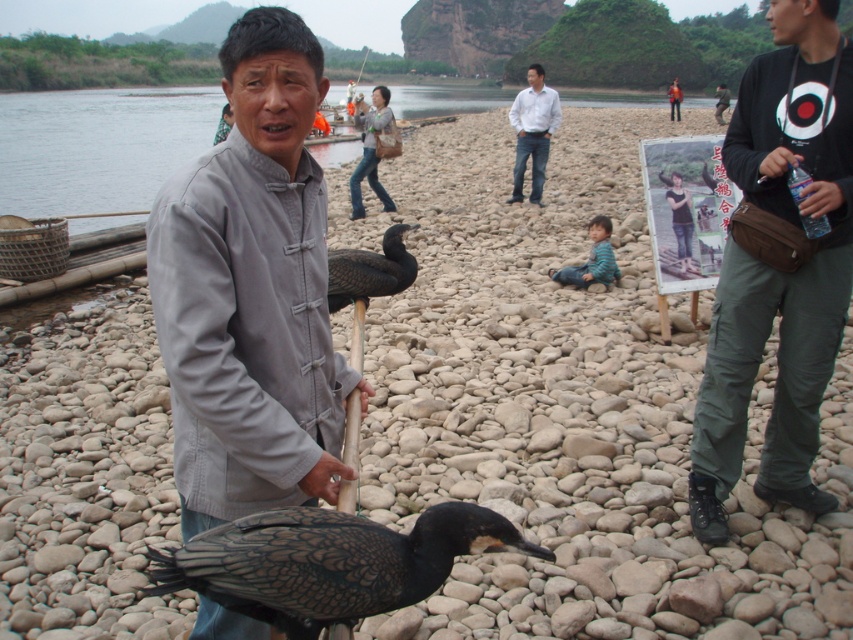
Question: Which object is closer to the camera taking this photo?

Choices:
 (A) gray matte jacket at center
 (B) light blue shirt at center

Answer: (A)

Question: Where is light blue shirt at center located in relation to dark green jacket at center in the image?

Choices:
 (A) right
 (B) left

Answer: (B)

Question: Does black cotton shirt at right lie in front of dark green jacket at center?

Choices:
 (A) no
 (B) yes

Answer: (B)

Question: Does black cotton shirt at right lie in front of orange fabric jacket at center?

Choices:
 (A) no
 (B) yes

Answer: (B)

Question: Which object is farther from the camera taking this photo?

Choices:
 (A) dark brown feathers at center
 (B) black matte bird at center

Answer: (B)

Question: Which is nearer to the black matte bird at center?

Choices:
 (A) gray matte jacket at center
 (B) black cotton shirt at right

Answer: (A)